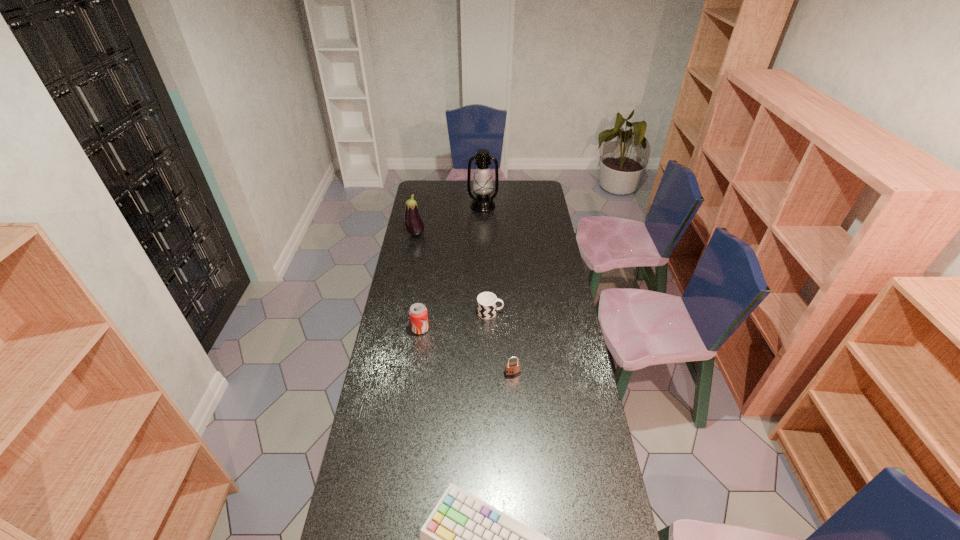
Locate an element on the screen. free point located 0.390m on the front of the oil lamp is located at coordinates (483, 254).

Where is `vacant space located 0.280m on the right of the fifth shortest object`? Image resolution: width=960 pixels, height=540 pixels. vacant space located 0.280m on the right of the fifth shortest object is located at coordinates (477, 234).

In order to click on free spot located on the front of the third nearest object in this screenshot , I will do `click(414, 377)`.

Where is `free space located on the right of the fifth farthest object`? The width and height of the screenshot is (960, 540). free space located on the right of the fifth farthest object is located at coordinates (567, 374).

This screenshot has height=540, width=960. What are the coordinates of `vacant space located 0.270m on the side of the fourth nearest object with the handle` in the screenshot? It's located at (564, 313).

You are a GUI agent. You are given a task and a screenshot of the screen. Output one action in this format:
    pyautogui.click(x=<x>, y=<y>)
    Task: Click on the object that is positioned at the far edge
    
    Given the screenshot: What is the action you would take?
    pyautogui.click(x=482, y=186)

This screenshot has width=960, height=540. In order to click on eggplant located at the left edge in this screenshot , I will do `click(414, 225)`.

Where is `soda can located at the left edge`? This screenshot has height=540, width=960. soda can located at the left edge is located at coordinates (418, 314).

Identify the location of free space at the far edge of the desktop. (444, 190).

This screenshot has width=960, height=540. Find the location of `vacant area at the right edge of the desktop`. vacant area at the right edge of the desktop is located at coordinates (524, 221).